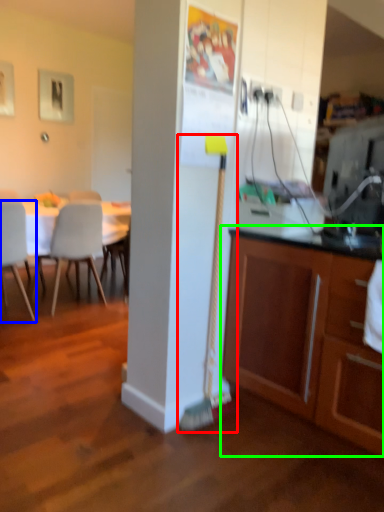
Question: Based on their relative distances, which object is farther from brush (highlighted by a red box)? Choose from chair (highlighted by a blue box) and cabinetry (highlighted by a green box).

Choices:
 (A) chair
 (B) cabinetry

Answer: (A)